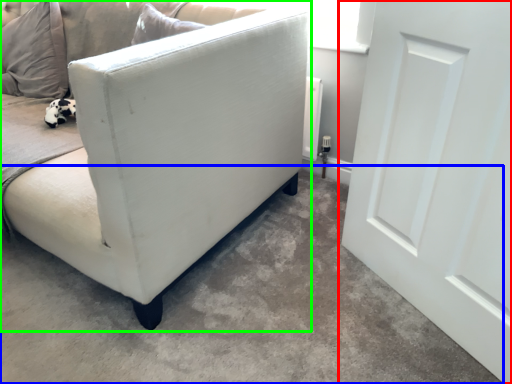
Question: Estimate the real-world distances between objects in this image. Which object is closer to door (highlighted by a red box), concrete (highlighted by a blue box) or studio couch (highlighted by a green box)?

Choices:
 (A) concrete
 (B) studio couch

Answer: (A)